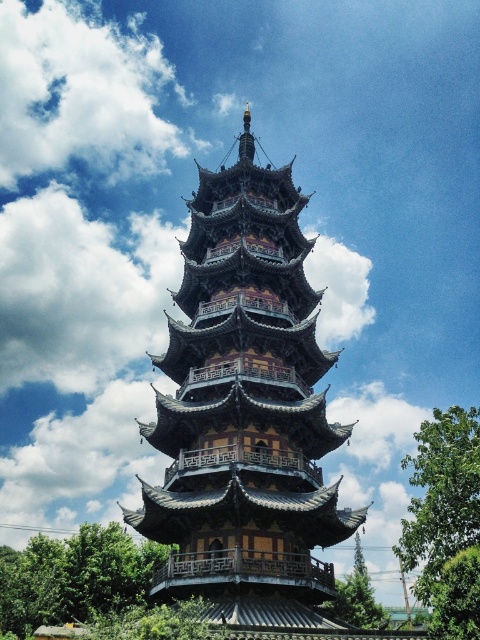
Is wooden pagoda at center closer to camera compared to green leafy tree at right?

No.

Between wooden pagoda at center and green leafy tree at right, which one has more height?

wooden pagoda at center

This screenshot has width=480, height=640. I want to click on wooden pagoda at center, so click(x=245, y=412).

What do you see at coordinates (245, 412) in the screenshot? I see `wooden pagoda at center` at bounding box center [245, 412].

Which is below, wooden pagoda at center or green leafy tree at center?

green leafy tree at center is below.

What do you see at coordinates (245, 412) in the screenshot? The image size is (480, 640). I see `wooden pagoda at center` at bounding box center [245, 412].

Identify the location of wooden pagoda at center. (245, 412).

Is green leafy tree at lower left to the right of green leafy tree at center from the viewer's perspective?

No, green leafy tree at lower left is not to the right of green leafy tree at center.

Find the location of a particular element. The height and width of the screenshot is (640, 480). green leafy tree at lower left is located at coordinates (73, 577).